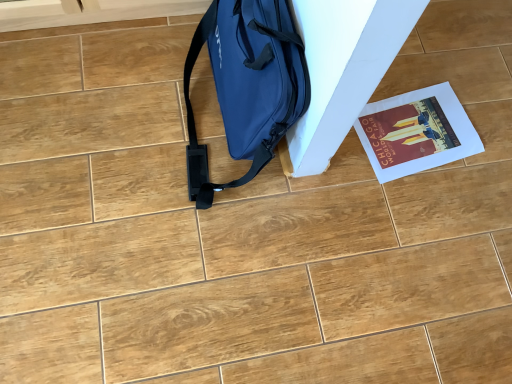
This screenshot has width=512, height=384. What do you see at coordinates (247, 85) in the screenshot?
I see `matte blue bag at center-left` at bounding box center [247, 85].

What is the approximate width of matte blue bag at center-left?

The width of matte blue bag at center-left is 9.92 inches.

Measure the distance between point (190, 182) and camera.

Point (190, 182) is 38.46 inches away from camera.

This screenshot has height=384, width=512. In order to click on matte blue bag at center-left in this screenshot , I will do `click(247, 85)`.

At what (x,y) coordinates should I click in order to perform the action: click on matte paper poster at lower right. Please return your answer as a coordinate pair (x, y). The height and width of the screenshot is (384, 512). Looking at the image, I should click on (416, 132).

What do you see at coordinates (416, 132) in the screenshot? This screenshot has width=512, height=384. I see `matte paper poster at lower right` at bounding box center [416, 132].

The image size is (512, 384). I want to click on matte blue bag at center-left, so click(x=247, y=85).

Considering the relative positions of matte blue bag at center-left and matte paper poster at lower right in the image provided, is matte blue bag at center-left to the right of matte paper poster at lower right from the viewer's perspective?

No, matte blue bag at center-left is not to the right of matte paper poster at lower right.

Between matte blue bag at center-left and matte paper poster at lower right, which one is positioned behind?

Positioned behind is matte paper poster at lower right.

Does point (280, 57) come closer to viewer compared to point (358, 132)?

Yes, it is.

From the image's perspective, which is below, matte blue bag at center-left or matte paper poster at lower right?

matte paper poster at lower right, from the image's perspective.

From a real-world perspective, who is located lower, matte blue bag at center-left or matte paper poster at lower right?

matte paper poster at lower right.

Considering the sizes of matte blue bag at center-left and matte paper poster at lower right in the image, is matte blue bag at center-left wider or thinner than matte paper poster at lower right?

Considering their sizes, matte blue bag at center-left looks slimmer than matte paper poster at lower right.

Does matte blue bag at center-left have a lesser height compared to matte paper poster at lower right?

Incorrect, the height of matte blue bag at center-left does not fall short of that of matte paper poster at lower right.

Does matte blue bag at center-left have a larger size compared to matte paper poster at lower right?

Yes.

Consider the image. Is matte paper poster at lower right located within matte blue bag at center-left?

No, matte paper poster at lower right is not surrounded by matte blue bag at center-left.

Is matte blue bag at center-left next to matte paper poster at lower right and touching it?

matte blue bag at center-left and matte paper poster at lower right are clearly separated.

Is matte blue bag at center-left oriented towards matte paper poster at lower right?

No, matte blue bag at center-left is not turned towards matte paper poster at lower right.

Can you tell me how much matte blue bag at center-left and matte paper poster at lower right differ in facing direction?

There is a 7.98-degree angle between the facing directions of matte blue bag at center-left and matte paper poster at lower right.

You are a GUI agent. You are given a task and a screenshot of the screen. Output one action in this format:
    pyautogui.click(x=<x>, y=<y>)
    Task: Click on the luggage and bags in front of the matte paper poster at lower right
    
    Given the screenshot: What is the action you would take?
    pyautogui.click(x=247, y=85)

Between matte paper poster at lower right and matte blue bag at center-left, which one appears on the right side from the viewer's perspective?

matte paper poster at lower right is more to the right.

Which object is closer to the camera, matte paper poster at lower right or matte blue bag at center-left?

matte blue bag at center-left.

Considering the points (440, 143) and (200, 37), which point is behind, point (440, 143) or point (200, 37)?

The point (440, 143) is more distant.

From the image's perspective, relative to matte blue bag at center-left, is matte paper poster at lower right above or below?

Based on their image positions, matte paper poster at lower right is located beneath matte blue bag at center-left.

From a real-world perspective, is matte paper poster at lower right physically located above or below matte blue bag at center-left?

matte paper poster at lower right is below matte blue bag at center-left.

Can you confirm if matte paper poster at lower right is wider than matte blue bag at center-left?

Yes.

Who is shorter, matte paper poster at lower right or matte blue bag at center-left?

matte paper poster at lower right.

Considering the relative sizes of matte paper poster at lower right and matte blue bag at center-left in the image provided, is matte paper poster at lower right smaller than matte blue bag at center-left?

Yes, matte paper poster at lower right is smaller than matte blue bag at center-left.

Would you say matte paper poster at lower right is inside or outside matte blue bag at center-left?

matte paper poster at lower right lies outside matte blue bag at center-left.

Does matte paper poster at lower right touch matte blue bag at center-left?

No, matte paper poster at lower right is not beside matte blue bag at center-left.

Is matte paper poster at lower right oriented towards matte blue bag at center-left?

Yes, matte paper poster at lower right is aimed at matte blue bag at center-left.

Measure the distance from matte paper poster at lower right to matte blue bag at center-left.

matte paper poster at lower right and matte blue bag at center-left are 14.38 inches apart from each other.

This screenshot has height=384, width=512. In order to click on magazine on the right of matte blue bag at center-left in this screenshot , I will do `click(416, 132)`.

Find the location of a particular element. The width and height of the screenshot is (512, 384). luggage and bags in front of the matte paper poster at lower right is located at coordinates (247, 85).

Locate an element on the screen. This screenshot has height=384, width=512. magazine below the matte blue bag at center-left (from the image's perspective) is located at coordinates (416, 132).